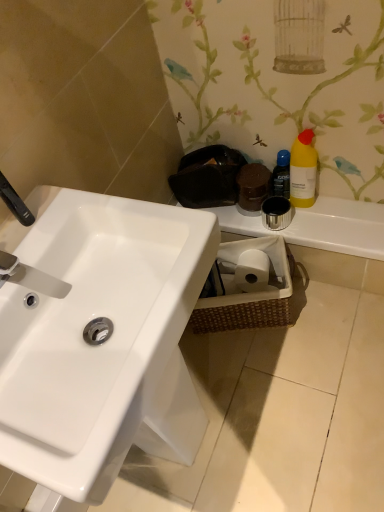
Locate an element on the screen. free location in front of brushed metal tap at upper left, the first plumbing fixture in the top-to-bottom sequence is located at coordinates (29, 249).